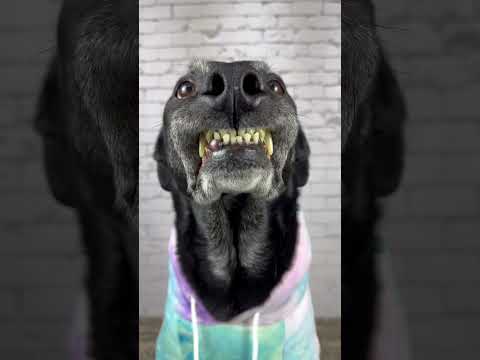
Locate an element on the screen. blurry white brick wall is located at coordinates (461, 36), (465, 325), (15, 31), (38, 301).